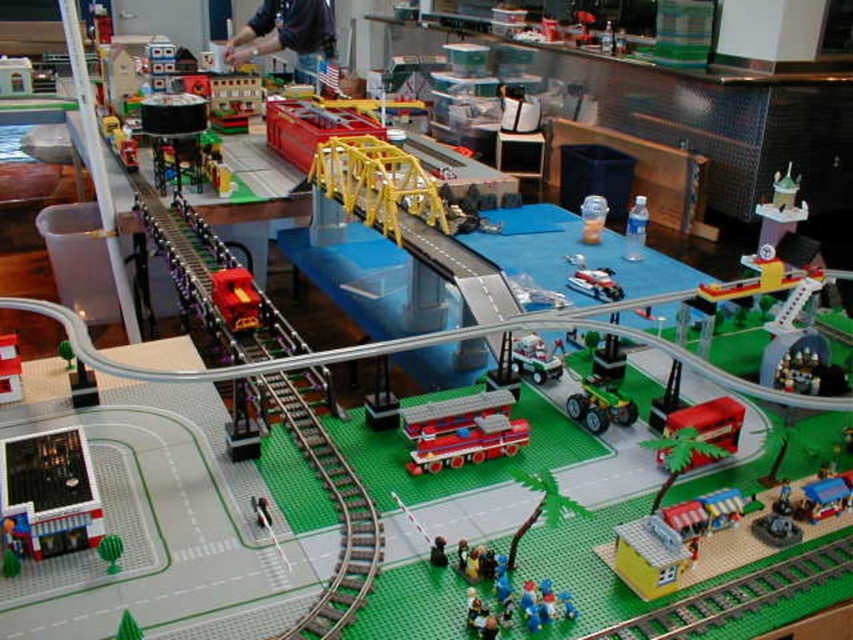
You are a Lego figure standing at the center of the green baseplate. You need to reach the green plastic train track at lower right. Which direction should you head towards?

The green plastic train track at lower right is located at point lower right, so you should head towards the lower right direction to reach it.